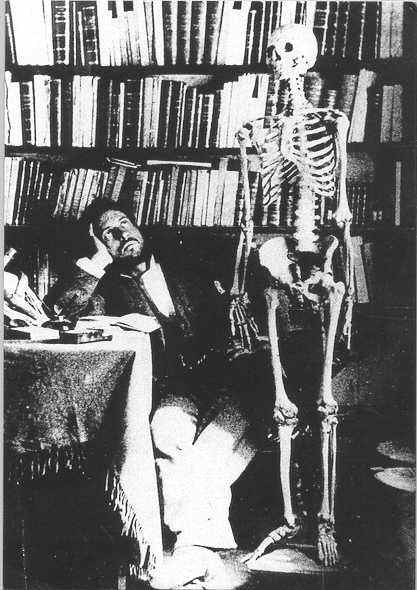
The width and height of the screenshot is (417, 590). I want to click on shoe, so click(x=193, y=559).